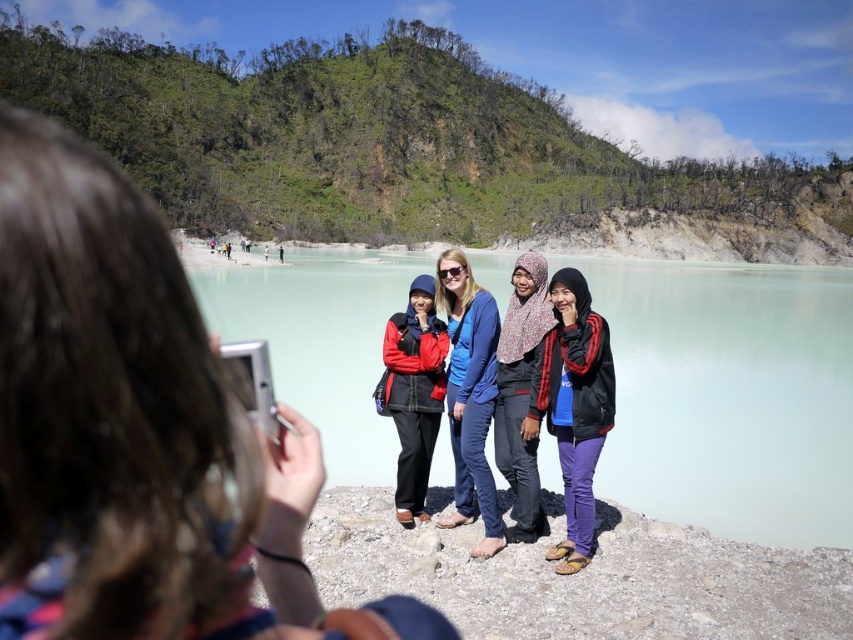
The image size is (853, 640). What do you see at coordinates (137, 432) in the screenshot?
I see `matte black jacket at center` at bounding box center [137, 432].

From the picture: Which is more to the right, matte black jacket at center or patterned fabric hijab at center?

From the viewer's perspective, patterned fabric hijab at center appears more on the right side.

Does point (221, 413) come farther from viewer compared to point (544, 275)?

No, (221, 413) is closer to viewer.

Find the location of a particular element. The image size is (853, 640). matte black jacket at center is located at coordinates (137, 432).

Does light blue water at center appear on the left side of patterned fabric hijab at center?

No, light blue water at center is not to the left of patterned fabric hijab at center.

Between point (825, 480) and point (515, 481), which one is positioned behind?

Point (825, 480)

Find the location of a particular element. light blue water at center is located at coordinates [730, 396].

Can you confirm if light blue water at center is positioned to the right of black matte jacket at center?

Correct, you'll find light blue water at center to the right of black matte jacket at center.

Which is in front, point (699, 323) or point (561, 385)?

Point (561, 385) is more forward.

Does point (621, 461) lie behind point (566, 323)?

Yes.

The height and width of the screenshot is (640, 853). Identify the location of light blue water at center. (730, 396).